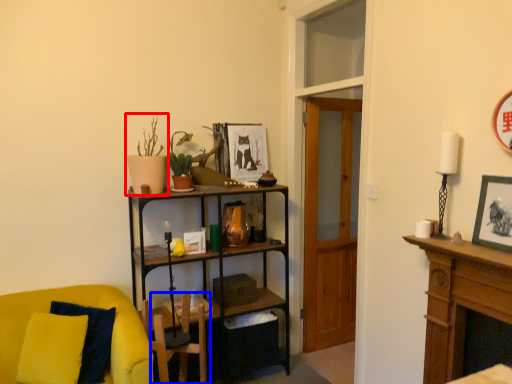
Question: Which point is closer to the camera, houseplant (highlighted by a red box) or swivel chair (highlighted by a blue box)?

Choices:
 (A) houseplant
 (B) swivel chair

Answer: (B)